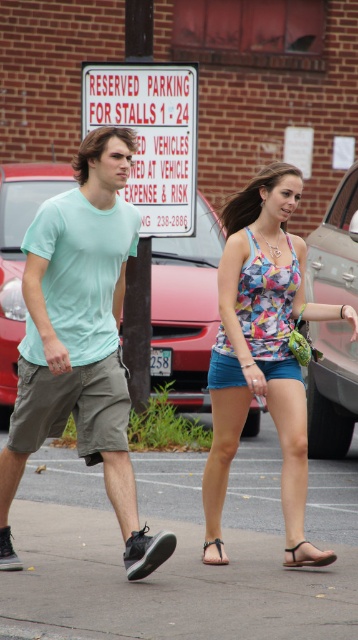
Does floral tank top at center have a lesser width compared to metallic silver car at right?

In fact, floral tank top at center might be wider than metallic silver car at right.

Is the position of floral tank top at center less distant than that of metallic silver car at right?

That is True.

The height and width of the screenshot is (640, 358). What do you see at coordinates (80, 340) in the screenshot?
I see `floral tank top at center` at bounding box center [80, 340].

Where is `floral tank top at center`? floral tank top at center is located at coordinates (80, 340).

Does light blue cotton t-shirt at center have a greater height compared to metallic silver car at right?

Yes.

Is light blue cotton t-shirt at center wider than metallic silver car at right?

Correct, the width of light blue cotton t-shirt at center exceeds that of metallic silver car at right.

Identify the location of light blue cotton t-shirt at center. The height and width of the screenshot is (640, 358). (80, 340).

Can you confirm if floral tank top at center is positioned to the left of black leather sandal at lower right?

Correct, you'll find floral tank top at center to the left of black leather sandal at lower right.

Is floral tank top at center closer to the viewer compared to black leather sandal at lower right?

Yes, it is in front of black leather sandal at lower right.

Between point (113, 504) and point (297, 563), which one is positioned in front?

Point (113, 504) is more forward.

You are a GUI agent. You are given a task and a screenshot of the screen. Output one action in this format:
    pyautogui.click(x=<x>, y=<y>)
    Task: Click on the floral tank top at center
    This screenshot has height=640, width=358.
    Given the screenshot: What is the action you would take?
    pyautogui.click(x=80, y=340)